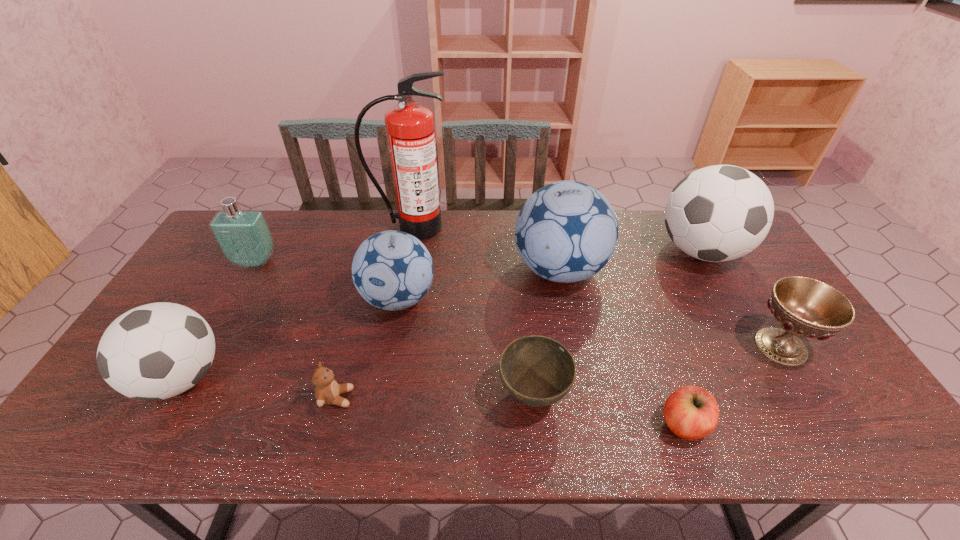
You are a GUI agent. You are given a task and a screenshot of the screen. Output one action in this format:
    pyautogui.click(x=<x>, y=<y>)
    Task: Click on the smaller black soccer ball
    Image resolution: width=960 pixels, height=540 pixels.
    Given the screenshot: What is the action you would take?
    156,351

In order to click on chalice in this screenshot , I will do `click(804, 307)`.

Locate an element on the screen. The height and width of the screenshot is (540, 960). the seventh tallest object is located at coordinates (804, 307).

Find the location of a particular element. The image size is (960, 540). bowl is located at coordinates (537, 371).

At what (x,y) coordinates should I click in order to perform the action: click on brown teddy bear. Please return your answer as a coordinate pair (x, y). Image resolution: width=960 pixels, height=540 pixels. Looking at the image, I should click on (327, 391).

The image size is (960, 540). What are the coordinates of `apple` in the screenshot? It's located at (691, 412).

This screenshot has height=540, width=960. I want to click on vacant position located 0.380m on the front-facing side of the fire extinguisher, so click(394, 323).

The width and height of the screenshot is (960, 540). I want to click on vacant space located on the front of the rightmost soccer ball, so click(x=776, y=382).

The width and height of the screenshot is (960, 540). In order to click on vacant space located 0.250m on the side with brand of the bigger blue soccer ball in this screenshot , I will do `click(433, 270)`.

The width and height of the screenshot is (960, 540). I want to click on vacant area located on the side with brand of the bigger blue soccer ball, so click(487, 270).